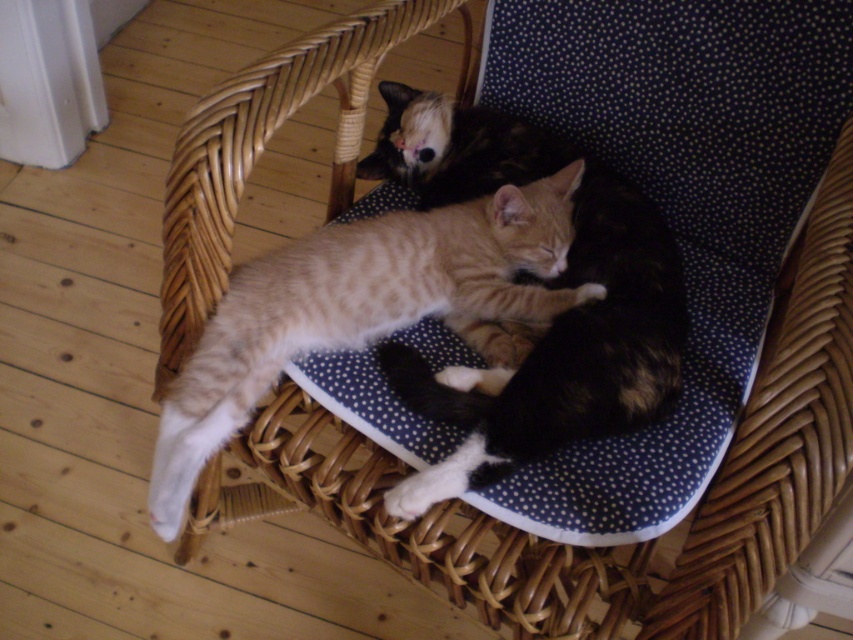
Who is higher up, tabby fur cat at center or striped fur cat at center?

tabby fur cat at center is higher up.

Is tabby fur cat at center to the right of striped fur cat at center from the viewer's perspective?

Yes, tabby fur cat at center is to the right of striped fur cat at center.

Which is in front, point (584, 332) or point (540, 300)?

Point (584, 332) is more forward.

Locate an element on the screen. The width and height of the screenshot is (853, 640). tabby fur cat at center is located at coordinates (552, 285).